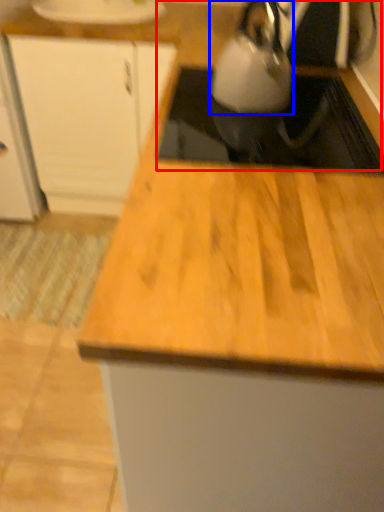
Question: Which point is closer to the camera, sink (highlighted by a red box) or kettle (highlighted by a blue box)?

Choices:
 (A) sink
 (B) kettle

Answer: (A)